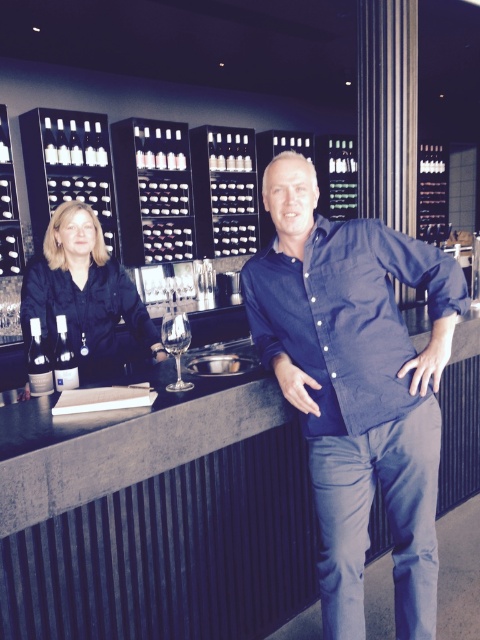
You are standing at the camera position in the wine cellar scene. There is a point marked at coordinates (66, 300). If you want to place a new wine bottle exactly 2 meters away from this point towards the bar counter, will it land on the counter or the floor?

The distance from the camera to the point is 2.35 meters. Placing the bottle 2 meters towards the bar counter from this point would result in a total distance of 2.35m minus 2m equals 0.35 meters from the camera. Since the bar counter is part of the scene setup, the bottle would likely land on the counter if within reach. However, without exact counter dimensions, we assume it stays on the counter.

You are a guest at the wine tasting event and want to grab a drink. The matte black shirt at left is a staff member. Can you reach the clear glass wine glass at center without moving the staff member?

The matte black shirt at left is much taller than the clear glass wine glass at center, so you might need to ask the staff member to move or adjust their position to access the glass.